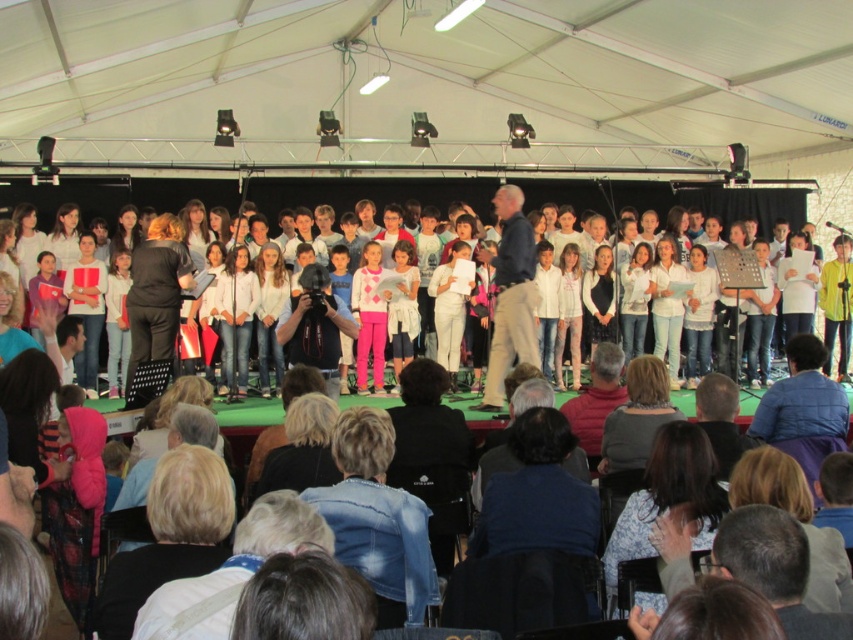
You are a photographer at the event and want to capture a clear shot of the denim jacket at lower center and the white cotton crowd at center. Which object should you focus on first to ensure it appears larger in the photo?

The denim jacket at lower center should be focused on first because it is bigger than the white cotton crowd at center, so capturing it first ensures it appears larger in the photo.

You are a photographer at the event and want to capture a clear photo of the denim jacket at lower center and the white cotton crowd at center. Which object should you focus on first to ensure it appears sharp in the photo?

The denim jacket at lower center should be focused on first because it is taller than the white cotton crowd at center, so focusing on the taller object first would ensure depth of field covers both subjects effectively.

You are a photographer standing at the back of the audience. You want to take a photo of the denim jacket at lower center and the white cotton crowd at center. Based on their sizes, which one should you focus on to ensure both are clearly visible in the frame?

The denim jacket at lower center might be wider than white cotton crowd at center, so focusing on the denim jacket at lower center would ensure both are visible as it occupies more space.